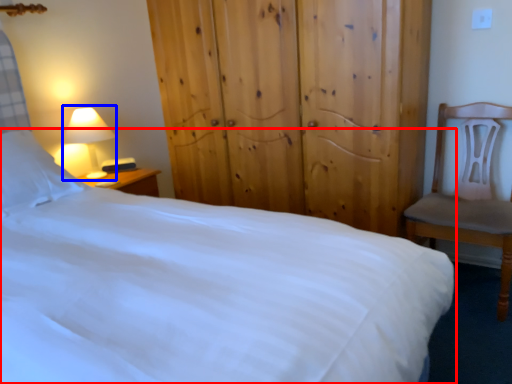
Question: Which object is further to the camera taking this photo, bed (highlighted by a red box) or lamp (highlighted by a blue box)?

Choices:
 (A) bed
 (B) lamp

Answer: (B)